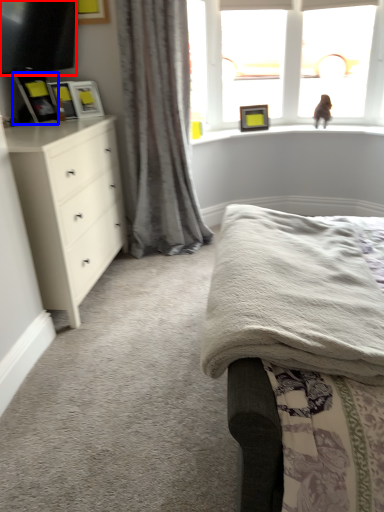
Question: Which object is further to the camera taking this photo, television (highlighted by a red box) or picture frame (highlighted by a blue box)?

Choices:
 (A) television
 (B) picture frame

Answer: (B)